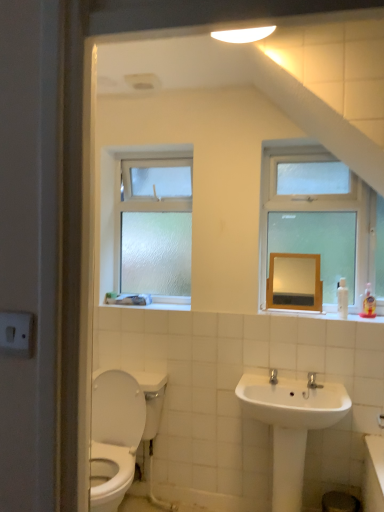
What are the coordinates of `matte wooden mirror at upper center` in the screenshot? It's located at 294,280.

Describe the element at coordinates (291, 425) in the screenshot. I see `white glossy sink at lower center` at that location.

What do you see at coordinates (317, 222) in the screenshot? The width and height of the screenshot is (384, 512). I see `clear glass window at upper right, placed as the 1th window when sorted from right to left` at bounding box center [317, 222].

What do you see at coordinates (119, 198) in the screenshot? The height and width of the screenshot is (512, 384). I see `frosted glass window at upper left, positioned as the 2th window in front-to-back order` at bounding box center [119, 198].

This screenshot has width=384, height=512. In order to click on matte wooden mirror at upper center in this screenshot , I will do `click(294, 280)`.

Between clear glass window at upper right, which is counted as the second window, starting from the back, and frosted glass window at upper left, which appears as the first window when viewed from the back, which one appears on the right side from the viewer's perspective?

clear glass window at upper right, which is counted as the second window, starting from the back, is more to the right.

Is clear glass window at upper right, which is counted as the second window, starting from the back, positioned with its back to frosted glass window at upper left, marked as the 2th window in a right-to-left arrangement?

clear glass window at upper right, which is counted as the second window, starting from the back, does not have its back to frosted glass window at upper left, marked as the 2th window in a right-to-left arrangement.

Do you think clear glass window at upper right, the 2th window in the left-to-right sequence, is within frosted glass window at upper left, the 1th window positioned from the left, or outside of it?

clear glass window at upper right, the 2th window in the left-to-right sequence, is spatially situated outside frosted glass window at upper left, the 1th window positioned from the left.

Measure the distance between white glossy sink at lower center and matte wooden mirror at upper center.

white glossy sink at lower center is 26.70 inches from matte wooden mirror at upper center.

From the image's perspective, is white glossy sink at lower center over matte wooden mirror at upper center?

Incorrect, from the image's perspective, white glossy sink at lower center is lower than matte wooden mirror at upper center.

Can you confirm if white glossy sink at lower center is thinner than matte wooden mirror at upper center?

Incorrect, the width of white glossy sink at lower center is not less than that of matte wooden mirror at upper center.

Does white glossy sink at lower center contain matte wooden mirror at upper center?

That's incorrect, matte wooden mirror at upper center is not inside white glossy sink at lower center.

Between matte wooden mirror at upper center and frosted glass window at upper left, positioned as the 2th window in front-to-back order, which one has more height?

frosted glass window at upper left, positioned as the 2th window in front-to-back order.

Identify the location of window that appears behind the matte wooden mirror at upper center. This screenshot has height=512, width=384. (119, 198).

In the image, is matte wooden mirror at upper center positioned in front of or behind frosted glass window at upper left, which appears as the first window when viewed from the back?

matte wooden mirror at upper center is positioned closer to the viewer than frosted glass window at upper left, which appears as the first window when viewed from the back.

Can we say matte wooden mirror at upper center lies outside frosted glass window at upper left, positioned as the 2th window in front-to-back order?

matte wooden mirror at upper center is positioned outside frosted glass window at upper left, positioned as the 2th window in front-to-back order.

From the picture: Is matte wooden mirror at upper center outside of white glossy sink at lower center?

Yes, matte wooden mirror at upper center is located beyond the bounds of white glossy sink at lower center.

From the image's perspective, is matte wooden mirror at upper center located above or below white glossy sink at lower center?

Clearly, from the image's perspective, matte wooden mirror at upper center is above white glossy sink at lower center.

Considering the sizes of objects matte wooden mirror at upper center and white glossy sink at lower center in the image provided, who is thinner, matte wooden mirror at upper center or white glossy sink at lower center?

Thinner between the two is matte wooden mirror at upper center.

Which object is further away from the camera, matte wooden mirror at upper center or clear glass window at upper right, placed as the 1th window when sorted from right to left?

matte wooden mirror at upper center is further away from the camera.

Considering the sizes of objects matte wooden mirror at upper center and clear glass window at upper right, which is counted as the second window, starting from the back, in the image provided, who is taller, matte wooden mirror at upper center or clear glass window at upper right, which is counted as the second window, starting from the back,?

clear glass window at upper right, which is counted as the second window, starting from the back.

Is clear glass window at upper right, which appears as the 1th window when viewed from the front, at the back of matte wooden mirror at upper center?

Yes.

Considering the sizes of objects matte wooden mirror at upper center and clear glass window at upper right, which appears as the 1th window when viewed from the front, in the image provided, who is thinner, matte wooden mirror at upper center or clear glass window at upper right, which appears as the 1th window when viewed from the front,?

matte wooden mirror at upper center is thinner.

Considering the relative sizes of white glossy sink at lower center and clear glass window at upper right, which appears as the 1th window when viewed from the front, in the image provided, is white glossy sink at lower center taller than clear glass window at upper right, which appears as the 1th window when viewed from the front,?

In fact, white glossy sink at lower center may be shorter than clear glass window at upper right, which appears as the 1th window when viewed from the front.

From the picture: Could you tell me if white glossy sink at lower center is turned towards clear glass window at upper right, which appears as the 1th window when viewed from the front?

No, white glossy sink at lower center is not facing towards clear glass window at upper right, which appears as the 1th window when viewed from the front.

Are white glossy sink at lower center and clear glass window at upper right, the 2th window in the left-to-right sequence, located far from each other?

No.

From the image's perspective, is white glossy sink at lower center over clear glass window at upper right, placed as the 1th window when sorted from right to left?

No, from the image's perspective, white glossy sink at lower center is not on top of clear glass window at upper right, placed as the 1th window when sorted from right to left.

From the image's perspective, is white glossy sink at lower center located beneath frosted glass window at upper left, marked as the 2th window in a right-to-left arrangement?

Yes, from the image's perspective, white glossy sink at lower center is beneath frosted glass window at upper left, marked as the 2th window in a right-to-left arrangement.

Which object is positioned more to the left, white glossy sink at lower center or frosted glass window at upper left, the 1th window positioned from the left?

frosted glass window at upper left, the 1th window positioned from the left, is more to the left.

Is white glossy sink at lower center smaller than frosted glass window at upper left, the 1th window positioned from the left?

Actually, white glossy sink at lower center might be larger than frosted glass window at upper left, the 1th window positioned from the left.

At what (x,y) coordinates should I click in order to perform the action: click on sink beneath the frosted glass window at upper left, which appears as the first window when viewed from the back (from a real-world perspective). Please return your answer as a coordinate pair (x, y). Looking at the image, I should click on (291, 425).

The width and height of the screenshot is (384, 512). What are the coordinates of `window below the clear glass window at upper right, placed as the 1th window when sorted from right to left (from a real-world perspective)` in the screenshot? It's located at (119, 198).

Locate an element on the screen. The width and height of the screenshot is (384, 512). sink located in front of the matte wooden mirror at upper center is located at coordinates (291, 425).

Looking at the image, which one is located further to matte wooden mirror at upper center, clear glass window at upper right, placed as the 1th window when sorted from right to left, or frosted glass window at upper left, positioned as the 2th window in front-to-back order?

Based on the image, frosted glass window at upper left, positioned as the 2th window in front-to-back order, appears to be further to matte wooden mirror at upper center.

Looking at the image, which one is located further to clear glass window at upper right, placed as the 1th window when sorted from right to left, matte wooden mirror at upper center or frosted glass window at upper left, which appears as the first window when viewed from the back?

Based on the image, frosted glass window at upper left, which appears as the first window when viewed from the back, appears to be further to clear glass window at upper right, placed as the 1th window when sorted from right to left.

Estimate the real-world distances between objects in this image. Which object is closer to white glossy sink at lower center, frosted glass window at upper left, marked as the 2th window in a right-to-left arrangement, or clear glass window at upper right, placed as the 1th window when sorted from right to left?

Among the two, clear glass window at upper right, placed as the 1th window when sorted from right to left, is located nearer to white glossy sink at lower center.

From the image, which object appears to be farther from matte wooden mirror at upper center, white glossy sink at lower center or frosted glass window at upper left, marked as the 2th window in a right-to-left arrangement?

frosted glass window at upper left, marked as the 2th window in a right-to-left arrangement, is further to matte wooden mirror at upper center.

Based on their spatial positions, is matte wooden mirror at upper center or white glossy sink at lower center further from clear glass window at upper right, which appears as the 1th window when viewed from the front?

Among the two, white glossy sink at lower center is located further to clear glass window at upper right, which appears as the 1th window when viewed from the front.

Based on their spatial positions, is white glossy sink at lower center or clear glass window at upper right, placed as the 1th window when sorted from right to left, closer to matte wooden mirror at upper center?

clear glass window at upper right, placed as the 1th window when sorted from right to left.

When comparing their distances from frosted glass window at upper left, positioned as the 2th window in front-to-back order, does clear glass window at upper right, which appears as the 1th window when viewed from the front, or white glossy sink at lower center seem further?

The object further to frosted glass window at upper left, positioned as the 2th window in front-to-back order, is white glossy sink at lower center.

Looking at the image, which one is located closer to matte wooden mirror at upper center, clear glass window at upper right, the 2th window in the left-to-right sequence, or white glossy sink at lower center?

clear glass window at upper right, the 2th window in the left-to-right sequence, lies closer to matte wooden mirror at upper center than the other object.

Find the location of a particular element. This screenshot has width=384, height=512. mirror between frosted glass window at upper left, marked as the 2th window in a right-to-left arrangement, and white glossy sink at lower center vertically is located at coordinates (294, 280).

You are a GUI agent. You are given a task and a screenshot of the screen. Output one action in this format:
    pyautogui.click(x=<x>, y=<y>)
    Task: Click on the window between frosted glass window at upper left, positioned as the 2th window in front-to-back order, and white glossy sink at lower center, in the vertical direction
    
    Given the screenshot: What is the action you would take?
    pyautogui.click(x=317, y=222)

You are a GUI agent. You are given a task and a screenshot of the screen. Output one action in this format:
    pyautogui.click(x=<x>, y=<y>)
    Task: Click on the mirror located between frosted glass window at upper left, marked as the 2th window in a right-to-left arrangement, and clear glass window at upper right, which appears as the 1th window when viewed from the front, in the left-right direction
    The height and width of the screenshot is (512, 384).
    Given the screenshot: What is the action you would take?
    pyautogui.click(x=294, y=280)

Identify the location of mirror between clear glass window at upper right, placed as the 1th window when sorted from right to left, and white glossy sink at lower center vertically. Image resolution: width=384 pixels, height=512 pixels. (294, 280).